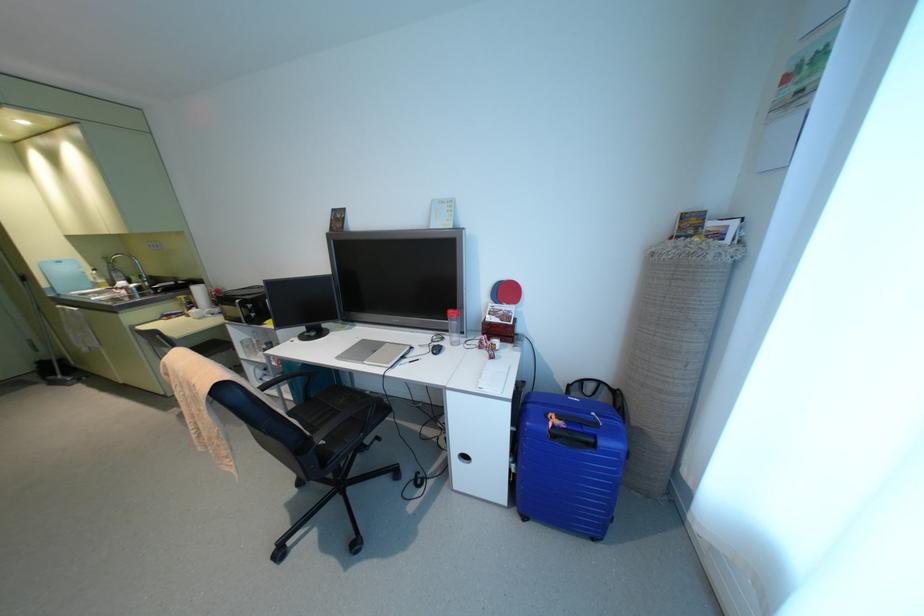
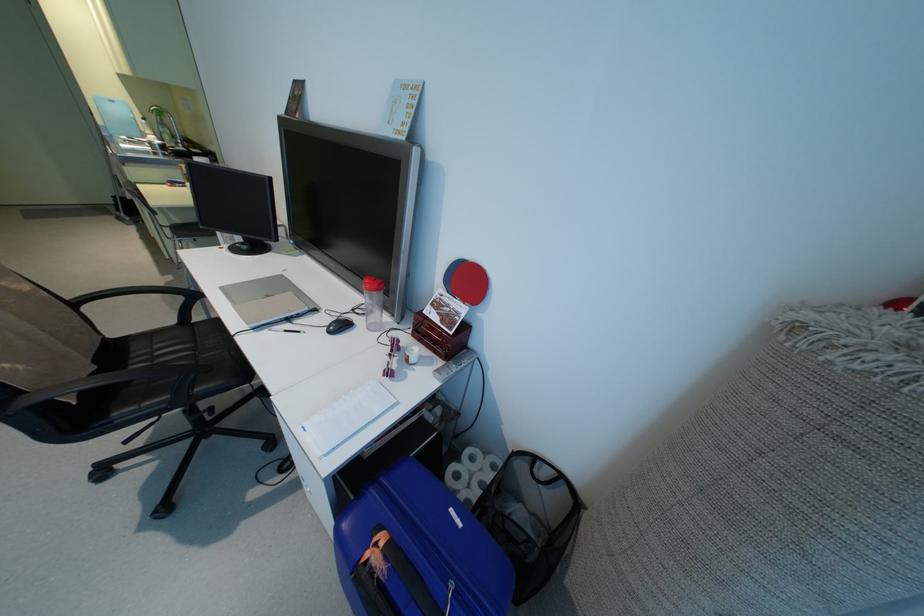
Question: How did the camera likely rotate?

Choices:
 (A) Left
 (B) Right
 (C) Up
 (D) Down

Answer: (D)